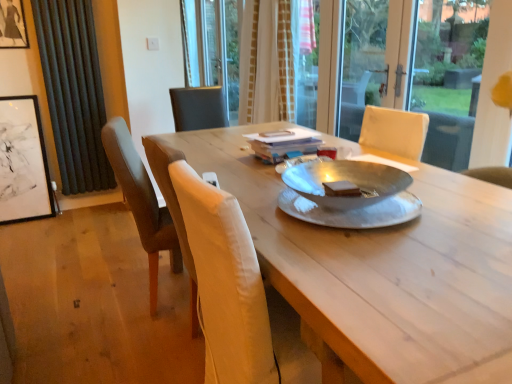
Question: Does wooden table at center lie in front of transparent glass screen door at upper center?

Choices:
 (A) no
 (B) yes

Answer: (B)

Question: Is wooden table at center wider than transparent glass screen door at upper center?

Choices:
 (A) no
 (B) yes

Answer: (B)

Question: Considering the relative positions of wooden table at center and transparent glass screen door at upper center in the image provided, is wooden table at center behind transparent glass screen door at upper center?

Choices:
 (A) no
 (B) yes

Answer: (A)

Question: From the image's perspective, is wooden table at center on transparent glass screen door at upper center?

Choices:
 (A) no
 (B) yes

Answer: (A)

Question: Is transparent glass screen door at upper center located within wooden table at center?

Choices:
 (A) no
 (B) yes

Answer: (A)

Question: Visually, is black matte picture frame at left, the 2th picture frame from the top, positioned to the left or to the right of wooden table at center?

Choices:
 (A) left
 (B) right

Answer: (A)

Question: Looking at the image, does black matte picture frame at left, positioned as the first picture frame in bottom-to-top order, seem bigger or smaller compared to wooden table at center?

Choices:
 (A) big
 (B) small

Answer: (B)

Question: From a real-world perspective, relative to wooden table at center, is black matte picture frame at left, the 2th picture frame from the top, vertically above or below?

Choices:
 (A) above
 (B) below

Answer: (A)

Question: Is point (6, 165) positioned closer to the camera than point (344, 264)?

Choices:
 (A) farther
 (B) closer

Answer: (A)

Question: From a real-world perspective, relative to dark grey fabric curtain at left, which appears as the 1th curtain when viewed from the left, is black matte picture frame at left, the 2th picture frame from the top, vertically above or below?

Choices:
 (A) above
 (B) below

Answer: (B)

Question: In the image, is black matte picture frame at left, the 2th picture frame from the top, on the left side or the right side of dark grey fabric curtain at left, which appears as the 1th curtain when viewed from the left?

Choices:
 (A) right
 (B) left

Answer: (B)

Question: From the image's perspective, is black matte picture frame at left, positioned as the first picture frame in bottom-to-top order, located above or below dark grey fabric curtain at left, which appears as the 1th curtain when viewed from the left?

Choices:
 (A) above
 (B) below

Answer: (B)

Question: In terms of width, does black matte picture frame at left, the 2th picture frame from the top, look wider or thinner when compared to dark grey fabric curtain at left, positioned as the second curtain in right-to-left order?

Choices:
 (A) wide
 (B) thin

Answer: (A)

Question: Is brown leather chair at left taller or shorter than wooden table at center?

Choices:
 (A) short
 (B) tall

Answer: (B)

Question: In the image, is brown leather chair at left positioned in front of or behind wooden table at center?

Choices:
 (A) behind
 (B) front

Answer: (A)